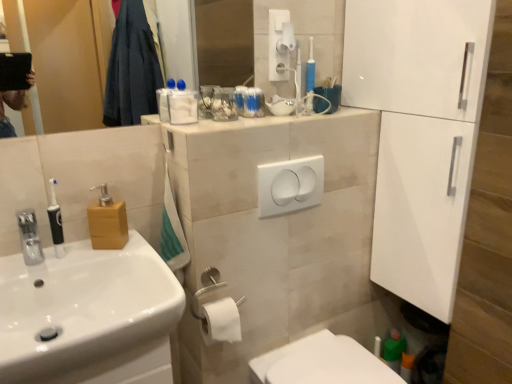
Identify the location of vacant area located to the right-hand side of translucent plastic toothbrushes at upper center, arranged as the second toiletry when ordered from the bottom. (302, 114).